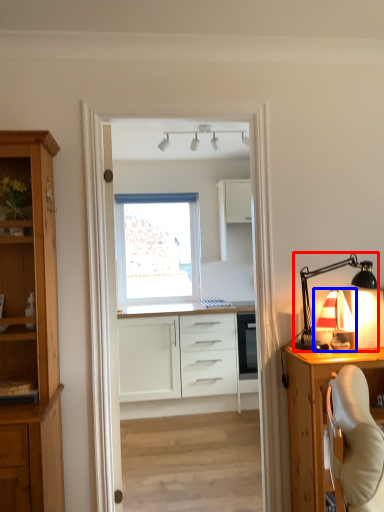
Question: Which of the following is the closest to the observer, lamp (highlighted by a red box) or table lamp (highlighted by a blue box)?

Choices:
 (A) lamp
 (B) table lamp

Answer: (A)